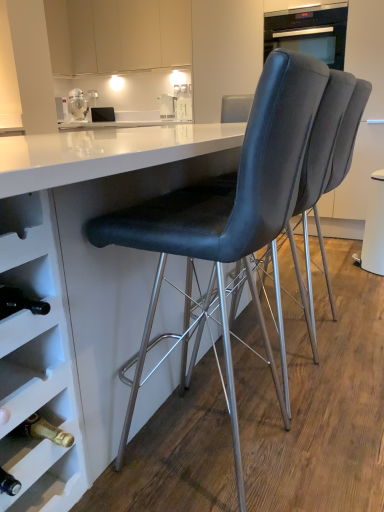
Question: Can you confirm if white glossy table at center is taller than metallic silver blender at upper left?

Choices:
 (A) yes
 (B) no

Answer: (A)

Question: Is white glossy table at center next to metallic silver blender at upper left and touching it?

Choices:
 (A) no
 (B) yes

Answer: (A)

Question: Are white glossy table at center and metallic silver blender at upper left far apart?

Choices:
 (A) yes
 (B) no

Answer: (A)

Question: From the image's perspective, is white glossy table at center over metallic silver blender at upper left?

Choices:
 (A) yes
 (B) no

Answer: (B)

Question: Is white glossy table at center outside of metallic silver blender at upper left?

Choices:
 (A) no
 (B) yes

Answer: (B)

Question: Considering the relative positions of white glossy table at center and metallic silver blender at upper left in the image provided, is white glossy table at center to the left of metallic silver blender at upper left from the viewer's perspective?

Choices:
 (A) yes
 (B) no

Answer: (B)

Question: Can you see black leather chair at center, marked as the second chair in a front-to-back arrangement, touching matte black chair at center, which ranks as the third chair in back-to-front order?

Choices:
 (A) yes
 (B) no

Answer: (B)

Question: Are black leather chair at center, marked as the second chair in a front-to-back arrangement, and matte black chair at center, which ranks as the third chair in back-to-front order, located far from each other?

Choices:
 (A) no
 (B) yes

Answer: (A)

Question: From a real-world perspective, does black leather chair at center, the 2th chair from the back, sit lower than matte black chair at center, the 1th chair from the front?

Choices:
 (A) no
 (B) yes

Answer: (B)

Question: Does black leather chair at center, marked as the second chair in a front-to-back arrangement, appear on the right side of matte black chair at center, which ranks as the third chair in back-to-front order?

Choices:
 (A) no
 (B) yes

Answer: (B)

Question: Is black leather chair at center, the 2th chair from the back, taller than matte black chair at center, which ranks as the third chair in back-to-front order?

Choices:
 (A) no
 (B) yes

Answer: (A)

Question: Is black leather chair at center, the 2th chair from the back, smaller than matte black chair at center, which ranks as the third chair in back-to-front order?

Choices:
 (A) yes
 (B) no

Answer: (A)

Question: Are matte black chair at center, the 3th chair positioned from the front, and black leather chair at center, marked as the second chair in a front-to-back arrangement, located far from each other?

Choices:
 (A) yes
 (B) no

Answer: (B)